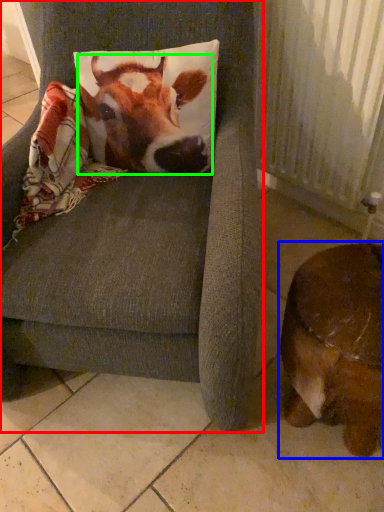
Question: Which object is the farthest from chair (highlighted by a red box)? Choose among these: dog (highlighted by a blue box) or cattle (highlighted by a green box).

Choices:
 (A) dog
 (B) cattle

Answer: (A)